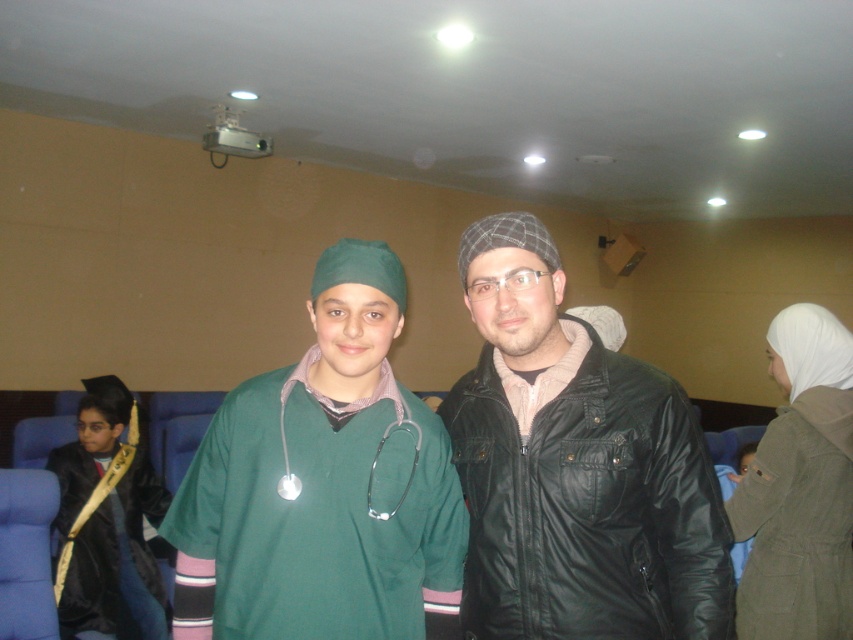
Question: Which object is the farthest from the green matte scrub at center?

Choices:
 (A) black satin graduation gown at lower left
 (B) black leather jacket at center
 (C) silver metallic stethoscope at center
 (D) white matte hijab at right

Answer: (A)

Question: Observing the image, what is the correct spatial positioning of green matte scrub at center in reference to silver metallic stethoscope at center?

Choices:
 (A) left
 (B) right

Answer: (A)

Question: Is black leather jacket at center positioned before black satin graduation gown at lower left?

Choices:
 (A) no
 (B) yes

Answer: (B)

Question: Which of the following is the farthest from the observer?

Choices:
 (A) silver metallic stethoscope at center
 (B) white matte hijab at right
 (C) green matte scrub at center

Answer: (B)

Question: Is black leather jacket at center further to camera compared to black satin graduation gown at lower left?

Choices:
 (A) no
 (B) yes

Answer: (A)

Question: Which object is positioned closest to the black leather jacket at center?

Choices:
 (A) green matte scrub at center
 (B) black satin graduation gown at lower left

Answer: (A)